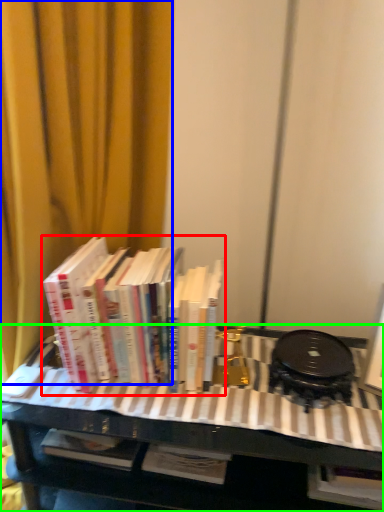
Question: Which object is positioned closest to book (highlighted by a red box)? Select from curtain (highlighted by a blue box) and table (highlighted by a green box).

Choices:
 (A) curtain
 (B) table

Answer: (B)